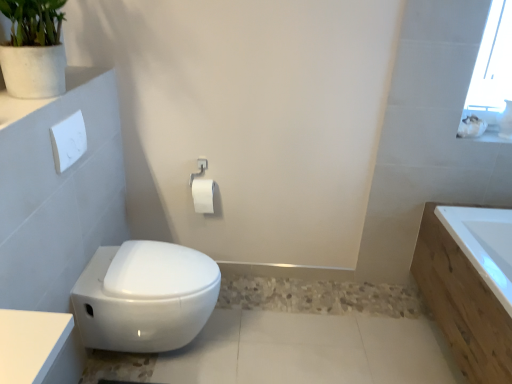
Question: Is white glossy ledge at upper left turned away from white matte toilet paper at center?

Choices:
 (A) yes
 (B) no

Answer: (B)

Question: Are white glossy ledge at upper left and white matte toilet paper at center beside each other?

Choices:
 (A) no
 (B) yes

Answer: (A)

Question: From the image's perspective, would you say white glossy ledge at upper left is shown under white matte toilet paper at center?

Choices:
 (A) yes
 (B) no

Answer: (B)

Question: Considering the relative sizes of white glossy ledge at upper left and white matte toilet paper at center in the image provided, is white glossy ledge at upper left wider than white matte toilet paper at center?

Choices:
 (A) no
 (B) yes

Answer: (B)

Question: From a real-world perspective, is white glossy ledge at upper left physically above white matte toilet paper at center?

Choices:
 (A) yes
 (B) no

Answer: (A)

Question: From a real-world perspective, is white glossy ledge at upper left positioned above or below white glossy bidet at lower left?

Choices:
 (A) above
 (B) below

Answer: (A)

Question: Looking at the image, does white glossy ledge at upper left seem bigger or smaller compared to white glossy bidet at lower left?

Choices:
 (A) big
 (B) small

Answer: (B)

Question: Is white glossy ledge at upper left spatially inside white glossy bidet at lower left, or outside of it?

Choices:
 (A) inside
 (B) outside

Answer: (B)

Question: In terms of width, does white glossy ledge at upper left look wider or thinner when compared to white glossy bidet at lower left?

Choices:
 (A) thin
 (B) wide

Answer: (A)

Question: From a real-world perspective, relative to white glossy ledge at upper left, is white glossy bidet at lower left vertically above or below?

Choices:
 (A) below
 (B) above

Answer: (A)

Question: From their relative heights in the image, would you say white glossy bidet at lower left is taller or shorter than white glossy ledge at upper left?

Choices:
 (A) tall
 (B) short

Answer: (A)

Question: Is white glossy bidet at lower left wider or thinner than white glossy ledge at upper left?

Choices:
 (A) thin
 (B) wide

Answer: (B)

Question: Would you say white glossy bidet at lower left is inside or outside white glossy ledge at upper left?

Choices:
 (A) outside
 (B) inside

Answer: (A)

Question: Considering their positions, is white glossy bidet at lower left located in front of or behind white wood bathtub at right?

Choices:
 (A) behind
 (B) front

Answer: (A)

Question: Choose the correct answer: Is white glossy bidet at lower left inside white wood bathtub at right or outside it?

Choices:
 (A) outside
 (B) inside

Answer: (A)